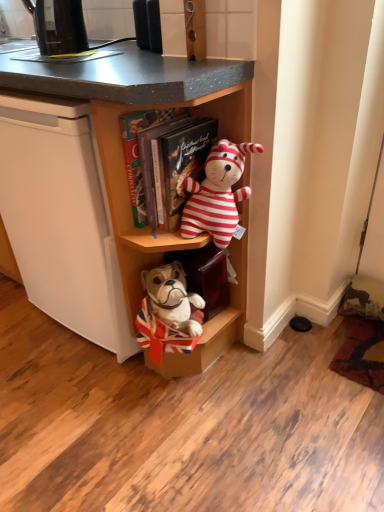
Locate an element on the screen. Image resolution: width=384 pixels, height=512 pixels. vacant area that is situated to the right of black plastic kettle at upper left is located at coordinates (120, 49).